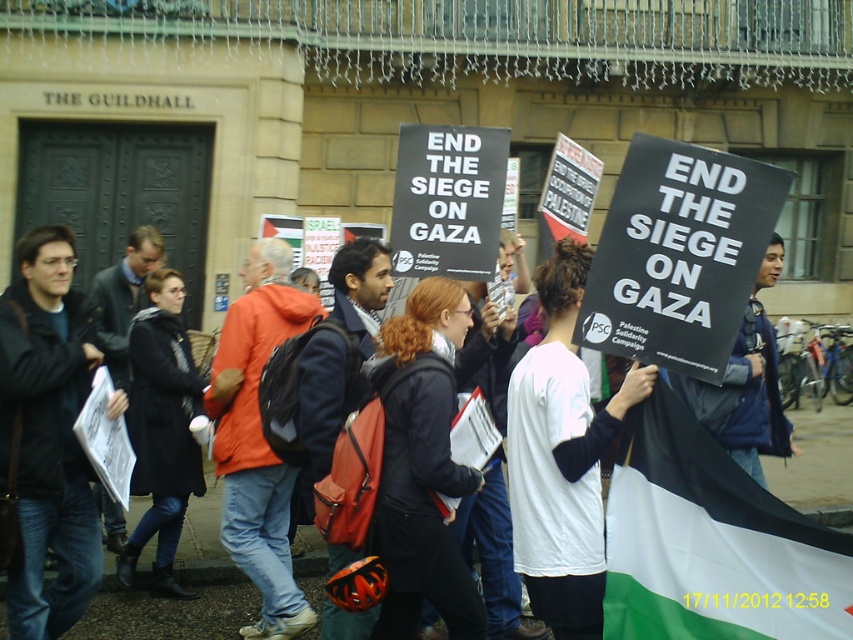
Question: Which object is closer to the camera taking this photo?

Choices:
 (A) blue denim jacket at center
 (B) white fabric flag at lower right
 (C) matte black jacket at center
 (D) orange fabric jacket at center

Answer: (B)

Question: In this image, where is white fabric flag at lower right located relative to orange fabric jacket at center?

Choices:
 (A) above
 (B) below

Answer: (B)

Question: Among these objects, which one is nearest to the camera?

Choices:
 (A) white fabric flag at lower right
 (B) orange fabric jacket at center
 (C) matte black jacket at center
 (D) blue denim jacket at center

Answer: (A)

Question: Is orange fabric jacket at center bigger than blue denim jacket at center?

Choices:
 (A) yes
 (B) no

Answer: (B)

Question: Is white fabric flag at lower right smaller than orange fabric jacket at center?

Choices:
 (A) no
 (B) yes

Answer: (A)

Question: Estimate the real-world distances between objects in this image. Which object is closer to the blue denim jacket at center?

Choices:
 (A) matte black jacket at center
 (B) orange fabric jacket at center

Answer: (B)